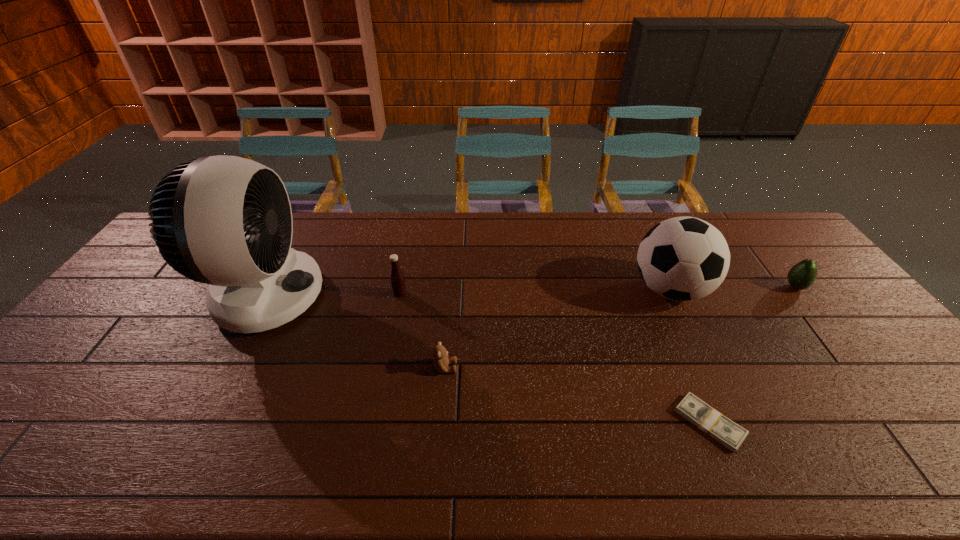
Where is `free space between the fan and the second tallest object`? free space between the fan and the second tallest object is located at coordinates (468, 293).

You are a GUI agent. You are given a task and a screenshot of the screen. Output one action in this format:
    pyautogui.click(x=<x>, y=<y>)
    Task: Click on the empty location between the fifth object from right to left and the fourth tallest object
    
    Given the screenshot: What is the action you would take?
    pyautogui.click(x=597, y=291)

The width and height of the screenshot is (960, 540). What are the coordinates of `blank region between the fourth shortest object and the tallest object` in the screenshot? It's located at (332, 295).

Locate an element on the screen. Image resolution: width=960 pixels, height=540 pixels. vacant space in between the dollar and the leftmost object is located at coordinates (487, 359).

Identify which object is the closest to the third tallest object. Please provide its 2D coordinates. Your answer should be formatted as a tuple, i.e. [(x, y)], where the tuple contains the x and y coordinates of a point satisfying the conditions above.

[(226, 221)]

You are a GUI agent. You are given a task and a screenshot of the screen. Output one action in this format:
    pyautogui.click(x=<x>, y=<y>)
    Task: Click on the object that is the third closest one to the fourth shortest object
    Image resolution: width=960 pixels, height=540 pixels.
    Given the screenshot: What is the action you would take?
    pyautogui.click(x=685, y=258)

You are a GUI agent. You are given a task and a screenshot of the screen. Output one action in this format:
    pyautogui.click(x=<x>, y=<y>)
    Task: Click on the vacant space that satisfies the following two spatial constraints: 1. on the grille of the tallest object; 2. on the back side of the nearest object
    Image resolution: width=960 pixels, height=540 pixels.
    Given the screenshot: What is the action you would take?
    pyautogui.click(x=196, y=423)

I want to click on free space that satisfies the following two spatial constraints: 1. on the front side of the fifth shortest object; 2. on the face of the fifth tallest object, so click(x=708, y=368).